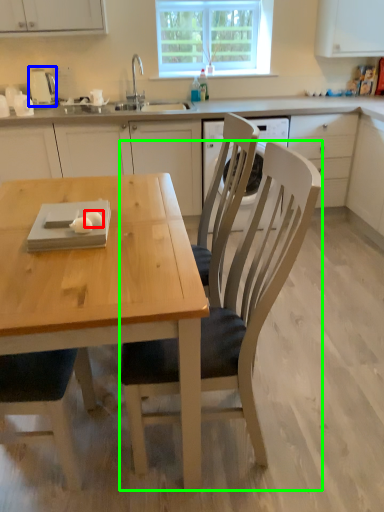
Question: Which object is the closest to the food (highlighted by a red box)? Choose among these: appliance (highlighted by a blue box) or chair (highlighted by a green box).

Choices:
 (A) appliance
 (B) chair

Answer: (B)